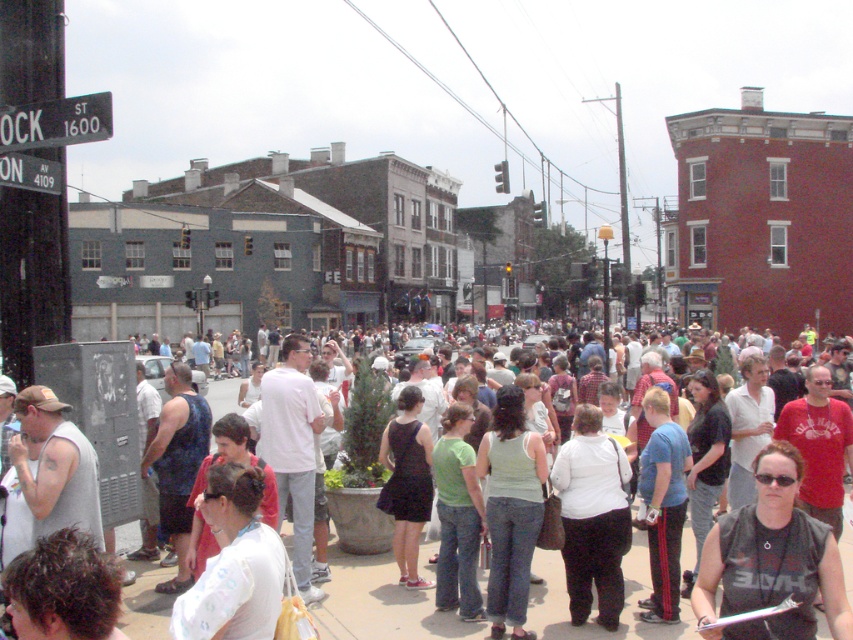
Question: Considering the real-world distances, which object is farthest from the black metal sign at upper left?

Choices:
 (A) white cotton shirt at center
 (B) white fabric shirt at lower left
 (C) black matte dress at center
 (D) white matte shirt at center

Answer: (D)

Question: Is white matte shirt at center above green matte tank top at center?

Choices:
 (A) no
 (B) yes

Answer: (A)

Question: Which object appears closest to the camera in this image?

Choices:
 (A) black matte dress at center
 (B) green matte tank top at center
 (C) white matte shirt at center

Answer: (B)

Question: Among these objects, which one is farthest from the camera?

Choices:
 (A) black matte dress at center
 (B) black metal sign at upper left
 (C) white cotton shirt at center

Answer: (A)

Question: Can you confirm if white matte shirt at center is positioned below black matte dress at center?

Choices:
 (A) yes
 (B) no

Answer: (A)

Question: Does black matte dress at center have a lesser width compared to black metal sign at upper left?

Choices:
 (A) yes
 (B) no

Answer: (B)